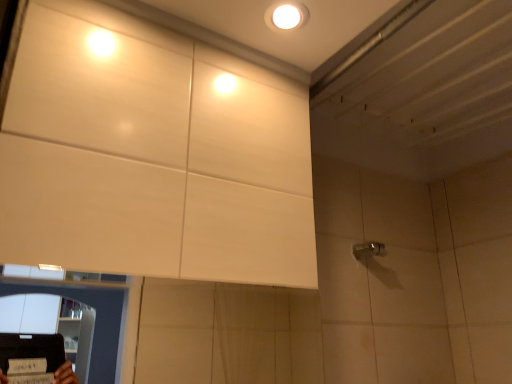
Question: From the image's perspective, is white glossy droplight at upper center under satin nickel faucet at right?

Choices:
 (A) yes
 (B) no

Answer: (B)

Question: From a real-world perspective, is white glossy droplight at upper center below satin nickel faucet at right?

Choices:
 (A) no
 (B) yes

Answer: (A)

Question: Is white glossy droplight at upper center facing away from satin nickel faucet at right?

Choices:
 (A) yes
 (B) no

Answer: (B)

Question: Can you confirm if white glossy droplight at upper center is taller than satin nickel faucet at right?

Choices:
 (A) no
 (B) yes

Answer: (A)

Question: From the image's perspective, is white glossy droplight at upper center located above satin nickel faucet at right?

Choices:
 (A) yes
 (B) no

Answer: (A)

Question: From a real-world perspective, does white glossy droplight at upper center stand above satin nickel faucet at right?

Choices:
 (A) yes
 (B) no

Answer: (A)

Question: Can you confirm if satin nickel faucet at right is bigger than white glossy droplight at upper center?

Choices:
 (A) yes
 (B) no

Answer: (A)

Question: Is satin nickel faucet at right to the left of white glossy droplight at upper center from the viewer's perspective?

Choices:
 (A) no
 (B) yes

Answer: (A)

Question: Is satin nickel faucet at right behind white glossy droplight at upper center?

Choices:
 (A) yes
 (B) no

Answer: (A)

Question: Does satin nickel faucet at right have a greater height compared to white glossy droplight at upper center?

Choices:
 (A) yes
 (B) no

Answer: (A)

Question: Can you confirm if satin nickel faucet at right is wider than white glossy droplight at upper center?

Choices:
 (A) yes
 (B) no

Answer: (B)

Question: Is satin nickel faucet at right positioned before white glossy droplight at upper center?

Choices:
 (A) no
 (B) yes

Answer: (A)

Question: From the image's perspective, is white glossy droplight at upper center positioned above or below satin nickel faucet at right?

Choices:
 (A) below
 (B) above

Answer: (B)